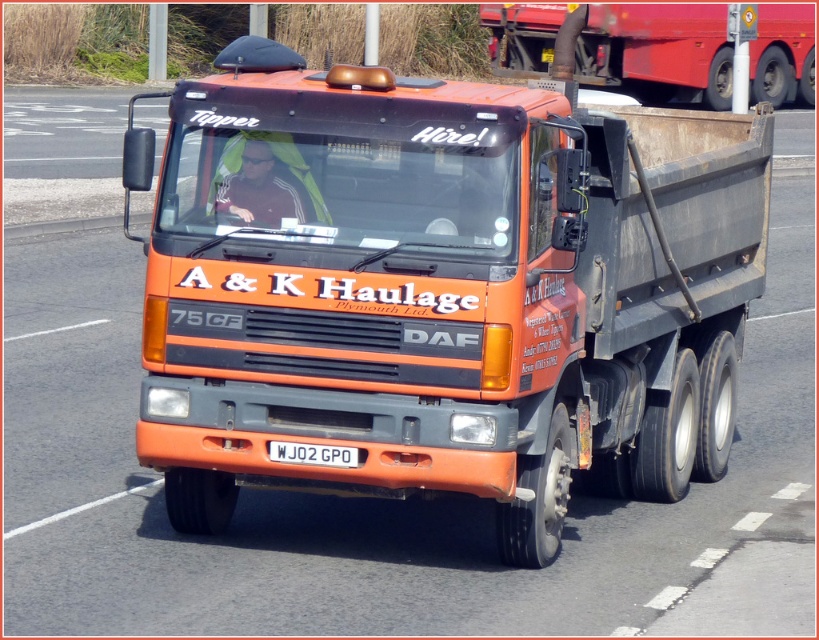
You are a traffic officer who needs to check the license plate of the orange matte trailer truck at center. Can you see the white plastic license plate at center clearly from your current position?

The orange matte trailer truck at center is positioned over the white plastic license plate at center, so the license plate is obscured and cannot be seen clearly.

Based on the scene description, what are the coordinates of the orange matte trailer truck at center?

The orange matte trailer truck at center is located at coordinates point (x=440, y=291).

You are standing on the side of the highway and see the orange matte trailer truck at center. If you start walking towards it at a speed of 3 miles per hour, how many minutes will it take you to reach the truck?

The distance between the orange matte trailer truck at center and the viewer is 30.70 feet. Converting 3 miles per hour to feet per minute gives 3 x 5280 feet per hour divided by 60 minutes equals 264 feet per minute. Dividing the distance by speed yields 30.70 divided by 264 equals approximately 0.116 minutes, so it would take roughly 0.116 minutes to reach the truck.